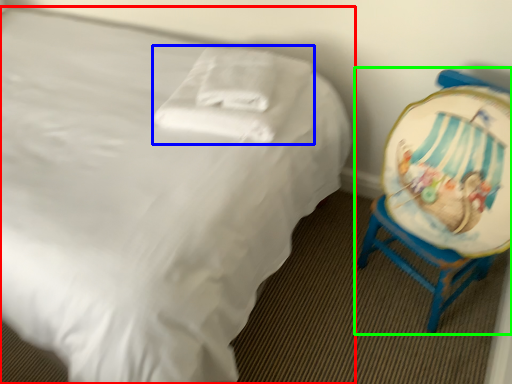
Question: Based on their relative distances, which object is nearer to bed (highlighted by a red box)? Choose from pillow (highlighted by a blue box) and chair (highlighted by a green box).

Choices:
 (A) pillow
 (B) chair

Answer: (A)